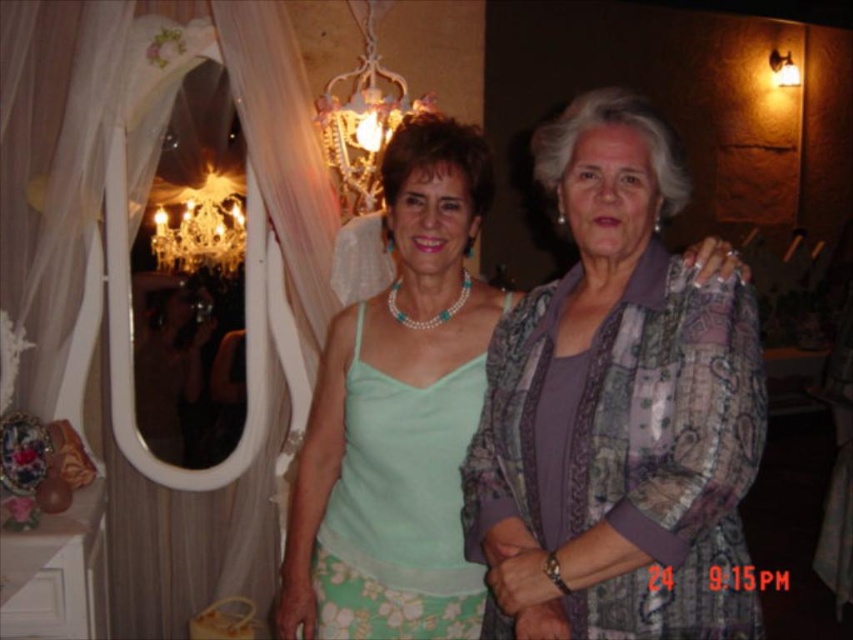
From the picture: Is shiny glass chandelier at upper center taller than crystal glass chandelier at upper left?

Indeed, shiny glass chandelier at upper center has a greater height compared to crystal glass chandelier at upper left.

Which is in front, point (355, 140) or point (238, 212)?

Positioned in front is point (355, 140).

From the picture: Who is more distant from viewer, (323, 90) or (202, 237)?

The point (323, 90) is behind.

Find the location of a particular element. The image size is (853, 640). shiny glass chandelier at upper center is located at coordinates coord(363,120).

Which is more to the left, patterned fabric blouse at center or crystal glass chandelier at upper left?

crystal glass chandelier at upper left

Does patterned fabric blouse at center have a lesser width compared to crystal glass chandelier at upper left?

Incorrect, patterned fabric blouse at center's width is not less than crystal glass chandelier at upper left's.

Between point (549, 340) and point (210, 260), which one is positioned in front?

Point (549, 340)

What are the coordinates of `patterned fabric blouse at center` in the screenshot? It's located at (618, 406).

Can you confirm if patterned fabric blouse at center is wider than shiny glass chandelier at upper center?

Yes, patterned fabric blouse at center is wider than shiny glass chandelier at upper center.

Where is `patterned fabric blouse at center`? This screenshot has height=640, width=853. patterned fabric blouse at center is located at coordinates (618, 406).